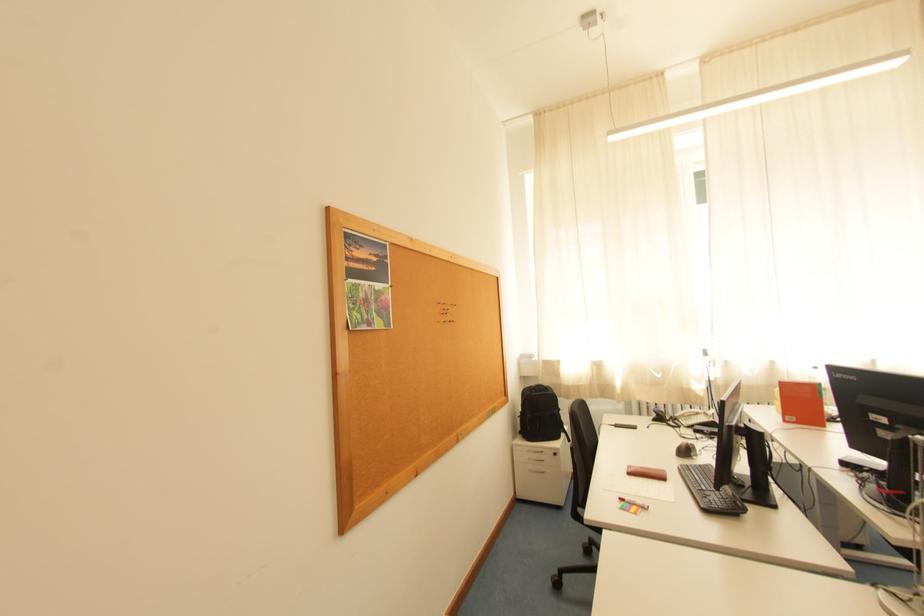
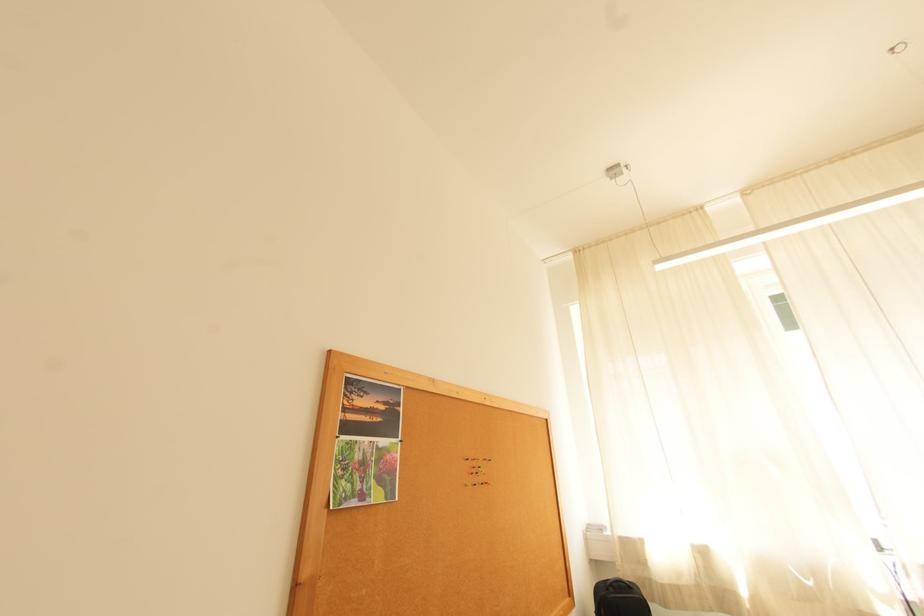
The point at (x=541, y=392) is marked in the first image. Where is the corresponding point in the second image?

(619, 591)